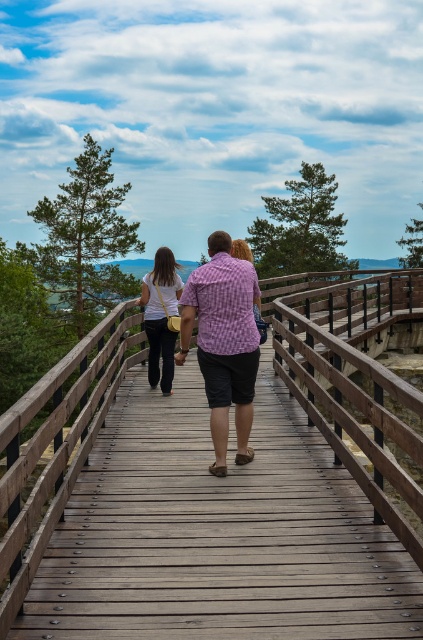
Does wooden bridge at center lie in front of pink checkered shirt at center?

Yes.

This screenshot has width=423, height=640. In order to click on wooden bridge at center in this screenshot , I will do `click(57, 445)`.

Find the location of a particular element. This screenshot has height=640, width=423. wooden bridge at center is located at coordinates (57, 445).

Is point (13, 412) positioned in front of point (164, 328)?

Yes.

Can you confirm if wooden bridge at center is positioned to the left of matte white shirt at center?

Incorrect, wooden bridge at center is not on the left side of matte white shirt at center.

The image size is (423, 640). I want to click on wooden bridge at center, so click(57, 445).

Who is positioned more to the left, pink checkered shirt at center or matte white shirt at center?

matte white shirt at center

Is pink checkered shirt at center taller than matte white shirt at center?

Yes, pink checkered shirt at center is taller than matte white shirt at center.

Does point (242, 292) lie behind point (153, 301)?

No, it is in front of (153, 301).

Where is `pink checkered shirt at center`? Image resolution: width=423 pixels, height=640 pixels. pink checkered shirt at center is located at coordinates (224, 342).